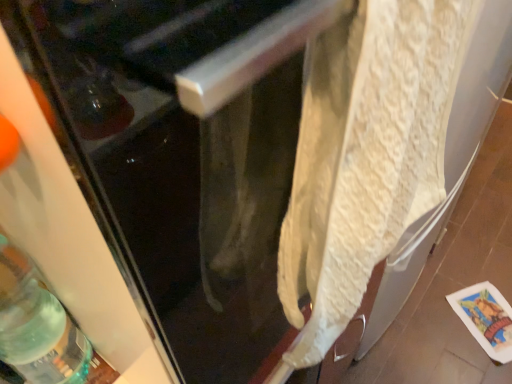
Measure the distance between point (343, 171) and camera.

The depth of point (343, 171) is 11.02 inches.

Find the location of `translucent green glass bottle at lower left`. translucent green glass bottle at lower left is located at coordinates (37, 325).

Is translucent green glass bottle at lower left facing away from white textured towel at center?

No, translucent green glass bottle at lower left's orientation is not away from white textured towel at center.

Is translucent green glass bottle at lower left bigger or smaller than white textured towel at center?

translucent green glass bottle at lower left is smaller than white textured towel at center.

Which object is closer to the camera, translucent green glass bottle at lower left or white textured towel at center?

Positioned in front is white textured towel at center.

Is translucent green glass bottle at lower left positioned far away from white textured towel at center?

That's not correct — translucent green glass bottle at lower left is a little close to white textured towel at center.

Where is `wrap lying on the right of white textured towel at right`? The width and height of the screenshot is (512, 384). wrap lying on the right of white textured towel at right is located at coordinates (366, 154).

Is point (88, 11) closer to viewer compared to point (384, 161)?

Yes.

Does white textured towel at right have a larger size compared to white textured towel at center?

Indeed, white textured towel at right has a larger size compared to white textured towel at center.

Is white textured towel at right inside or outside of white textured towel at center?

white textured towel at right cannot be found inside white textured towel at center.

Considering the relative positions of white textured towel at center and translucent green glass bottle at lower left in the image provided, is white textured towel at center to the right of translucent green glass bottle at lower left from the viewer's perspective?

Correct, you'll find white textured towel at center to the right of translucent green glass bottle at lower left.

Between white textured towel at center and translucent green glass bottle at lower left, which one has more height?

With more height is white textured towel at center.

From a real-world perspective, is white textured towel at center positioned over translucent green glass bottle at lower left based on gravity?

Yes.

In the scene shown: Can you tell me how much white textured towel at center and translucent green glass bottle at lower left differ in facing direction?

The angular difference between white textured towel at center and translucent green glass bottle at lower left is 1.3 degrees.

From a real-world perspective, which object rests below the other?

In real-world perspective, white textured towel at right is lower.

Are white textured towel at center and white textured towel at right far apart?

white textured towel at center is actually quite close to white textured towel at right.

What's the angular difference between white textured towel at center and white textured towel at right's facing directions?

The facing directions of white textured towel at center and white textured towel at right are 0.738 degrees apart.

Would you say white textured towel at center is to the left or to the right of white textured towel at right in the picture?

Clearly, white textured towel at center is on the right of white textured towel at right in the image.

Does translucent green glass bottle at lower left have a greater height compared to white textured towel at right?

No.

From the picture: Is translucent green glass bottle at lower left next to white textured towel at right?

No.

Based on the photo, is translucent green glass bottle at lower left positioned beyond the bounds of white textured towel at right?

Absolutely, translucent green glass bottle at lower left is external to white textured towel at right.

From the image's perspective, which one is positioned lower, white textured towel at right or translucent green glass bottle at lower left?

translucent green glass bottle at lower left is shown below in the image.

Which point is more distant from viewer, [229,333] or [11,263]?

The point [229,333] is farther from the camera.

Which of these two, white textured towel at right or translucent green glass bottle at lower left, is smaller?

With smaller size is translucent green glass bottle at lower left.

What are the coordinates of `wrap located above the translucent green glass bottle at lower left (from a real-world perspective)` in the screenshot? It's located at (366, 154).

You are a GUI agent. You are given a task and a screenshot of the screen. Output one action in this format:
    pyautogui.click(x=<x>, y=<y>)
    Task: Click on the screen door that is on the left side of white textured towel at center
    
    Given the screenshot: What is the action you would take?
    pyautogui.click(x=183, y=153)

Looking at this image, when comparing their distances from translucent green glass bottle at lower left, does white textured towel at right or white textured towel at center seem further?

white textured towel at center is further to translucent green glass bottle at lower left.

Which object lies nearer to the anchor point white textured towel at center, white textured towel at right or translucent green glass bottle at lower left?

white textured towel at right is closer to white textured towel at center.

When comparing their distances from white textured towel at right, does translucent green glass bottle at lower left or white textured towel at center seem closer?

white textured towel at center is closer to white textured towel at right.

Based on their spatial positions, is white textured towel at center or white textured towel at right closer to translucent green glass bottle at lower left?

The object closer to translucent green glass bottle at lower left is white textured towel at right.

Considering their positions, is white textured towel at center positioned closer to white textured towel at right than translucent green glass bottle at lower left?

white textured towel at center is positioned closer to the anchor white textured towel at right.

From the image, which object appears to be nearer to white textured towel at center, translucent green glass bottle at lower left or white textured towel at right?

white textured towel at right is closer to white textured towel at center.

This screenshot has width=512, height=384. Identify the location of screen door between translucent green glass bottle at lower left and white textured towel at center in the horizontal direction. (183, 153).